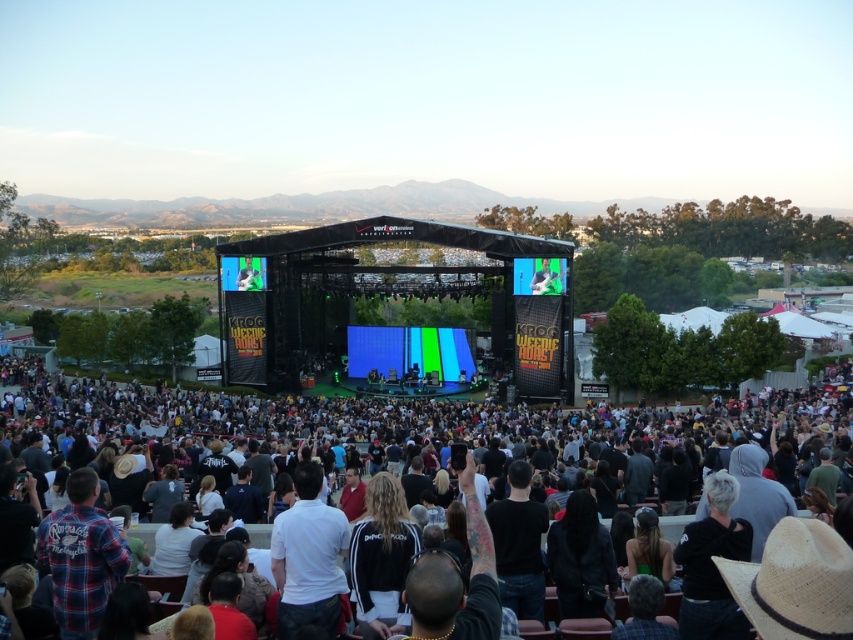
Question: Which is nearer to the white matte shirt at center?

Choices:
 (A) black fabric crowd at center
 (B) dark gray shirt at lower right
 (C) black matte shirt at center

Answer: (C)

Question: Is black matte shirt at center positioned before matte black screen at center?

Choices:
 (A) yes
 (B) no

Answer: (A)

Question: Estimate the real-world distances between objects in this image. Which object is closer to the matte black screen at center?

Choices:
 (A) natural straw cowboy hat at lower right
 (B) black leather jacket at center
 (C) black adidas jacket at center
 (D) white matte shirt at center

Answer: (D)

Question: From the image, what is the correct spatial relationship of black leather jacket at center in relation to matte black screen at center?

Choices:
 (A) left
 (B) right

Answer: (B)

Question: Among these points, which one is nearest to the camera?

Choices:
 (A) (102, 563)
 (B) (544, 520)

Answer: (A)

Question: Is black adidas jacket at center smaller than black matte shirt at center?

Choices:
 (A) no
 (B) yes

Answer: (A)